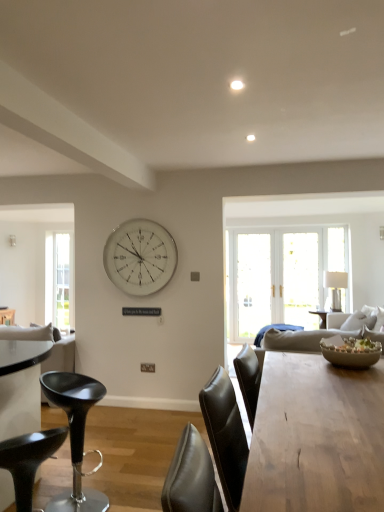
Measure the distance between point (89,387) and camera.

Point (89,387) and camera are 2.61 meters apart.

Find the location of a particular element. white glossy lamp at right is located at coordinates (335, 287).

What do you see at coordinates (351, 352) in the screenshot?
I see `beige ceramic bowl at lower right` at bounding box center [351, 352].

The height and width of the screenshot is (512, 384). Describe the element at coordinates (140, 257) in the screenshot. I see `silver metallic clock at center` at that location.

What is the approximate height of black leather stool at lower left, the second chair in the back-to-front sequence?

It is 23.02 inches.

Where is `black leather stool at lower left, which is the 2th chair in front-to-back order`? The height and width of the screenshot is (512, 384). black leather stool at lower left, which is the 2th chair in front-to-back order is located at coordinates (75, 436).

Considering the relative sizes of silver metallic clock at center and clear glass window at left in the image provided, is silver metallic clock at center wider than clear glass window at left?

In fact, silver metallic clock at center might be narrower than clear glass window at left.

Is clear glass window at left a part of silver metallic clock at center?

No, clear glass window at left is not surrounded by silver metallic clock at center.

From the picture: Based on their positions, is silver metallic clock at center located to the left or right of clear glass window at left?

silver metallic clock at center is to the right of clear glass window at left.

From a real-world perspective, does black leather stool at lower left, positioned as the first chair in front-to-back order, stand above silver metallic clock at center?

No, from a real-world perspective, black leather stool at lower left, positioned as the first chair in front-to-back order, is not over silver metallic clock at center

In the image, is black leather stool at lower left, the second chair in the back-to-front sequence, positioned in front of or behind silver metallic clock at center?

black leather stool at lower left, the second chair in the back-to-front sequence, is in front of silver metallic clock at center.

Consider the image. Is black leather stool at lower left, positioned as the first chair in front-to-back order, far from silver metallic clock at center?

Yes, black leather stool at lower left, positioned as the first chair in front-to-back order, and silver metallic clock at center are quite far apart.

Which is behind, point (324, 278) or point (66, 316)?

The point (66, 316) is behind.

Can you confirm if white glossy lamp at right is smaller than clear glass window at left?

No, white glossy lamp at right is not smaller than clear glass window at left.

From the picture: Considering the sizes of objects white glossy lamp at right and clear glass window at left in the image provided, who is taller, white glossy lamp at right or clear glass window at left?

Standing taller between the two is clear glass window at left.

Which object is further away from the camera, black leather stool at lower left, positioned as the first chair in front-to-back order, or black leather stool at lower left, the first chair from the back?

black leather stool at lower left, the first chair from the back, is more distant.

Measure the distance from black leather stool at lower left, positioned as the first chair in front-to-back order, to black leather stool at lower left, the first chair from the back.

black leather stool at lower left, positioned as the first chair in front-to-back order, is 11.42 inches away from black leather stool at lower left, the first chair from the back.

Is black leather stool at lower left, positioned as the first chair in front-to-back order, located outside black leather stool at lower left, the first chair from the back?

Yes, black leather stool at lower left, positioned as the first chair in front-to-back order, is outside of black leather stool at lower left, the first chair from the back.

Is black leather stool at lower left, positioned as the first chair in front-to-back order, positioned with its back to black leather stool at lower left, which is the 2th chair in front-to-back order?

No, black leather stool at lower left, positioned as the first chair in front-to-back order,'s orientation is not away from black leather stool at lower left, which is the 2th chair in front-to-back order.

Does white glossy lamp at right come behind silver metallic clock at center?

Yes, it is.

From a real-world perspective, is white glossy lamp at right above or below silver metallic clock at center?

From a real-world perspective, white glossy lamp at right is physically below silver metallic clock at center.

Could silver metallic clock at center be considered to be inside white glossy lamp at right?

That's incorrect, silver metallic clock at center is not inside white glossy lamp at right.

Which of these two, white glossy lamp at right or silver metallic clock at center, is thinner?

silver metallic clock at center.

Considering the positions of objects beige ceramic bowl at lower right and white glossy lamp at right in the image provided, who is more to the left, beige ceramic bowl at lower right or white glossy lamp at right?

beige ceramic bowl at lower right is more to the left.

From the image's perspective, is beige ceramic bowl at lower right on top of white glossy lamp at right?

No, from the image's perspective, beige ceramic bowl at lower right is not over white glossy lamp at right.

Relative to white glossy lamp at right, is beige ceramic bowl at lower right in front or behind?

A: Clearly, beige ceramic bowl at lower right is in front of white glossy lamp at right.

Could you tell me if beige ceramic bowl at lower right is facing white glossy lamp at right?

No, beige ceramic bowl at lower right is not oriented towards white glossy lamp at right.

Is black leather stool at lower left, the second chair in the back-to-front sequence, bigger or smaller than wooden table at center?

black leather stool at lower left, the second chair in the back-to-front sequence, is smaller than wooden table at center.

Which of these two, black leather stool at lower left, the second chair in the back-to-front sequence, or wooden table at center, is thinner?

Thinner between the two is black leather stool at lower left, the second chair in the back-to-front sequence.

From the image's perspective, which is below, black leather stool at lower left, the second chair in the back-to-front sequence, or wooden table at center?

black leather stool at lower left, the second chair in the back-to-front sequence, appears lower in the image.

Is the depth of black leather stool at lower left, positioned as the first chair in front-to-back order, greater than that of wooden table at center?

Yes, the depth of black leather stool at lower left, positioned as the first chair in front-to-back order, is greater than that of wooden table at center.

Find the location of a particular element. window that appears behind the silver metallic clock at center is located at coordinates (59, 280).

From a real-world perspective, count 2nd chairs downward from the silver metallic clock at center and point to it. Please provide its 2D coordinates.

[(28, 460)]

Looking at this image, which object lies further to the anchor point beige ceramic bowl at lower right, clear glass window at left or black leather stool at lower left, which is the 2th chair in front-to-back order?

Based on the image, clear glass window at left appears to be further to beige ceramic bowl at lower right.

Looking at the image, which one is located further to white glossy lamp at right, clear glass window at left or wooden table at center?

Among the two, clear glass window at left is located further to white glossy lamp at right.

From the image, which object appears to be nearer to clear glass window at left, silver metallic clock at center or white glossy lamp at right?

silver metallic clock at center is closer to clear glass window at left.

When comparing their distances from black leather stool at lower left, the first chair from the back, does silver metallic clock at center or clear glass window at left seem closer?

Based on the image, silver metallic clock at center appears to be nearer to black leather stool at lower left, the first chair from the back.

When comparing their distances from wooden table at center, does black leather stool at lower left, the first chair from the back, or beige ceramic bowl at lower right seem closer?

beige ceramic bowl at lower right.

Looking at the image, which one is located further to black leather stool at lower left, positioned as the first chair in front-to-back order, silver metallic clock at center or white glossy lamp at right?

white glossy lamp at right is further to black leather stool at lower left, positioned as the first chair in front-to-back order.

When comparing their distances from black leather stool at lower left, the first chair from the back, does beige ceramic bowl at lower right or black leather stool at lower left, positioned as the first chair in front-to-back order, seem closer?

black leather stool at lower left, positioned as the first chair in front-to-back order, lies closer to black leather stool at lower left, the first chair from the back, than the other object.

Based on their spatial positions, is black leather stool at lower left, the first chair from the back, or clear glass window at left further from beige ceramic bowl at lower right?

Based on the image, clear glass window at left appears to be further to beige ceramic bowl at lower right.

This screenshot has height=512, width=384. What are the coordinates of `chair situated between black leather stool at lower left, positioned as the first chair in front-to-back order, and wooden table at center from left to right` in the screenshot? It's located at click(x=75, y=436).

I want to click on chair between black leather stool at lower left, positioned as the first chair in front-to-back order, and beige ceramic bowl at lower right from left to right, so click(x=75, y=436).

You are a GUI agent. You are given a task and a screenshot of the screen. Output one action in this format:
    pyautogui.click(x=<x>, y=<y>)
    Task: Click on the lamp between black leather stool at lower left, the second chair in the back-to-front sequence, and clear glass window at left from front to back
    This screenshot has height=512, width=384.
    Given the screenshot: What is the action you would take?
    pyautogui.click(x=335, y=287)

Identify the location of wall clock between beige ceramic bowl at lower right and clear glass window at left along the z-axis. The width and height of the screenshot is (384, 512). [x=140, y=257].